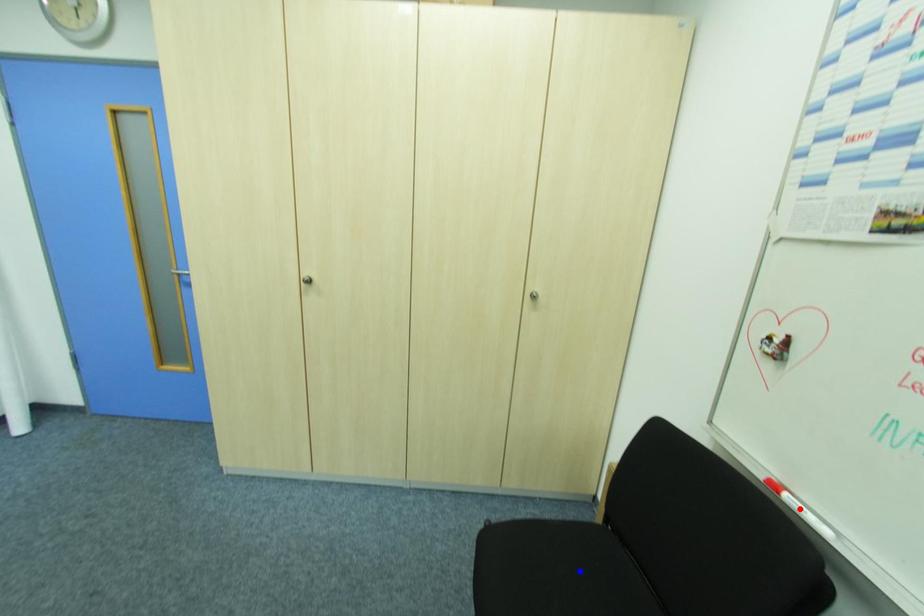
Question: Which of the two points in the image is closer to the camera?

Choices:
 (A) Blue point is closer.
 (B) Red point is closer.

Answer: (B)